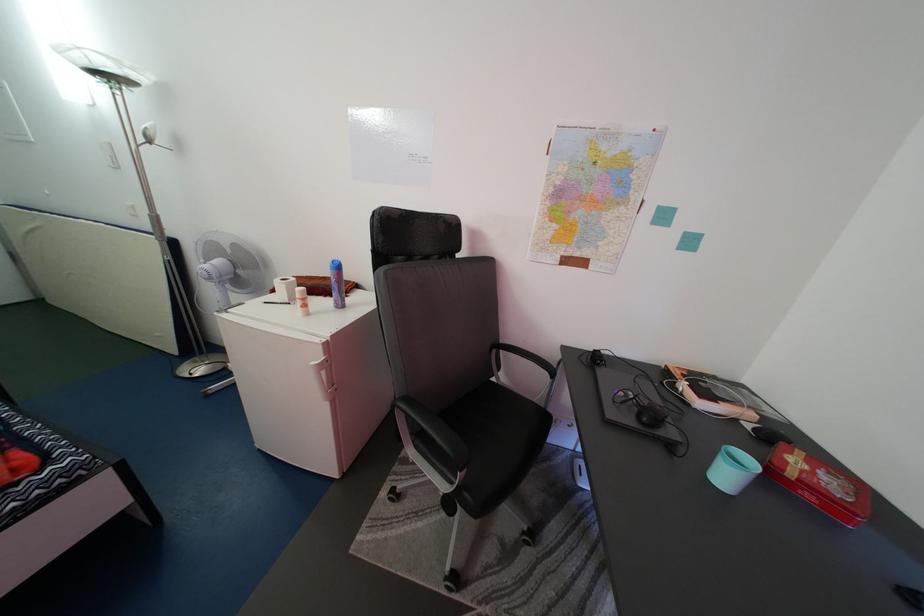
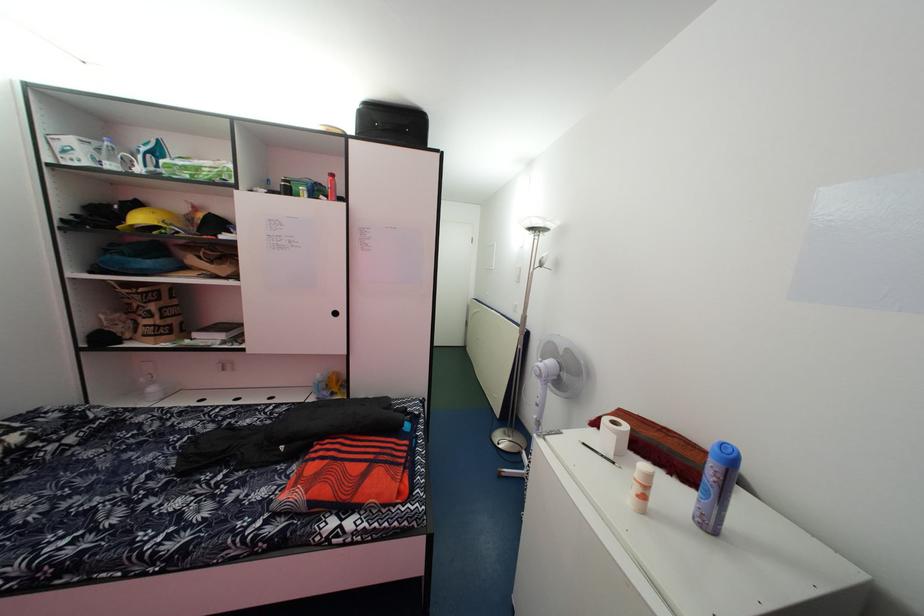
Question: The images are taken continuously from a first-person perspective. In which direction is your viewpoint rotating?

Choices:
 (A) Left
 (B) Right
 (C) Up
 (D) Down

Answer: (A)